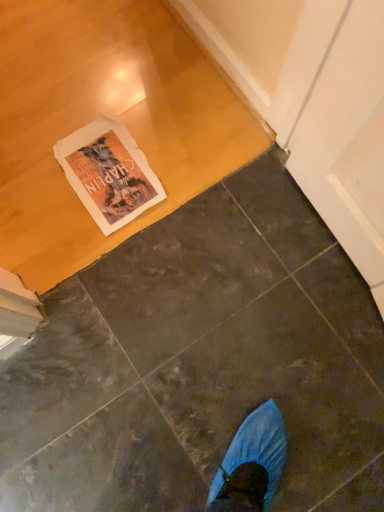
Identify the location of unoccupied area behind white paper magazine at upper left. (112, 74).